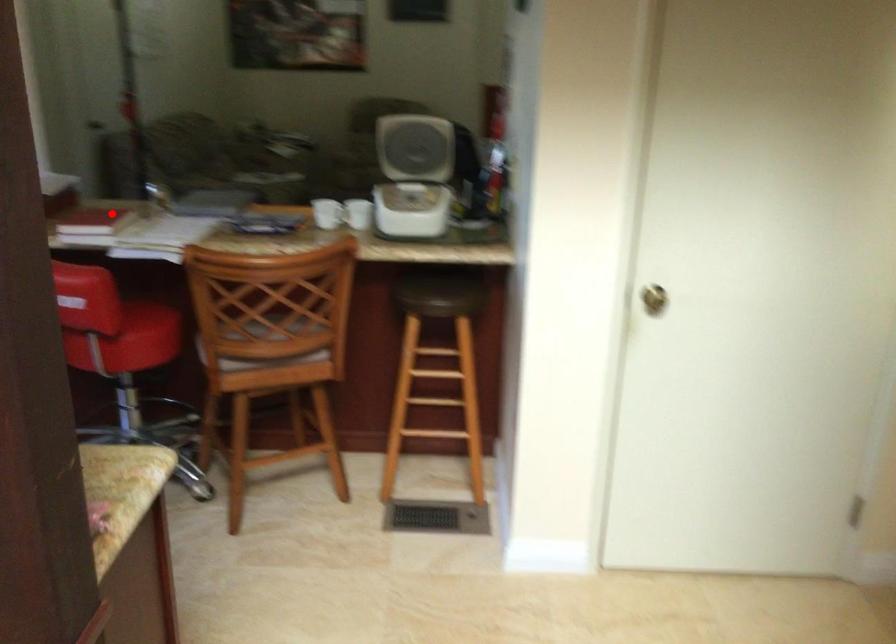
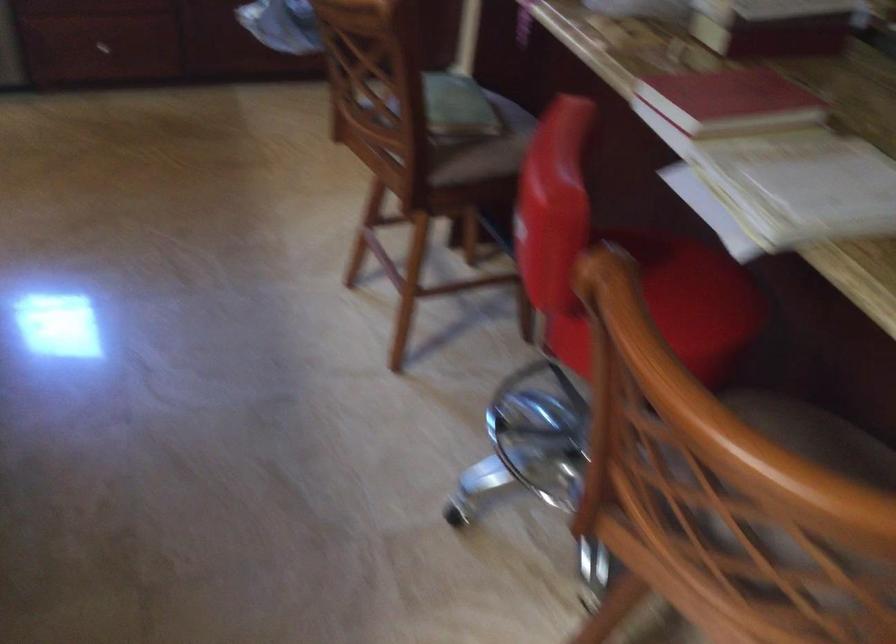
In the second image, find the point that corresponds to the highlighted location in the first image.

(729, 100)